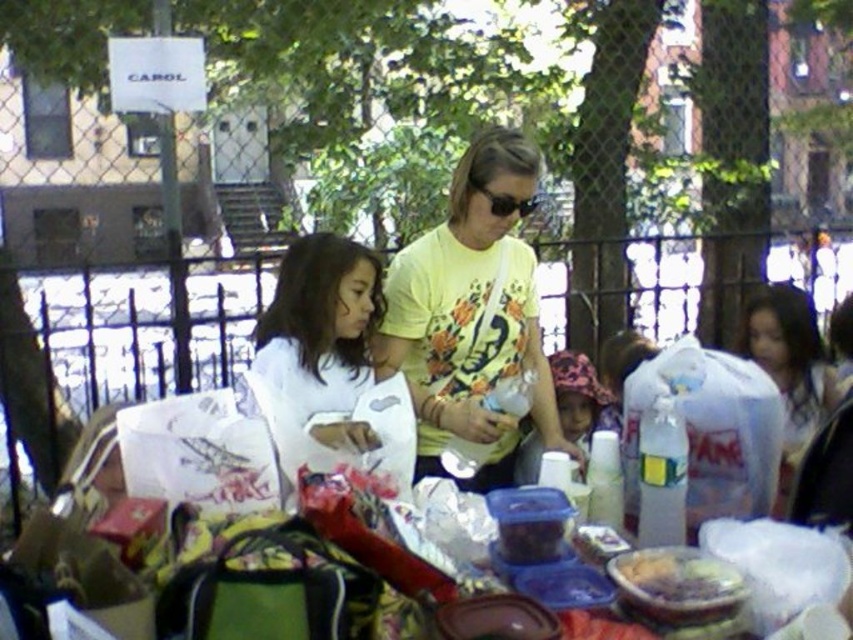
Is matte white shirt at right positioned behind matte pink hat at center?

No, it is not.

Is the position of matte white shirt at right less distant than that of matte pink hat at center?

Yes, it is.

I want to click on matte white shirt at right, so click(790, 371).

Locate an element on the screen. The image size is (853, 640). matte white shirt at right is located at coordinates (790, 371).

Between point (399, 268) and point (579, 396), which one is positioned behind?

The point (579, 396) is more distant.

This screenshot has height=640, width=853. Identify the location of yellow floral t-shirt at center. (471, 314).

Based on the photo, can you confirm if white matte shirt at center is taller than translucent plastic container at center?

Yes.

Does white matte shirt at center have a greater width compared to translucent plastic container at center?

Correct, the width of white matte shirt at center exceeds that of translucent plastic container at center.

Who is more forward, (334, 289) or (695, 566)?

Point (695, 566)

I want to click on white matte shirt at center, so click(322, 337).